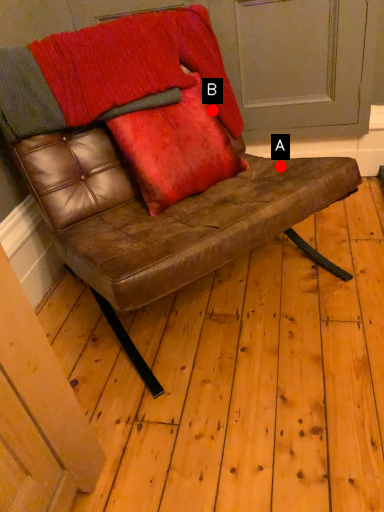
Question: Two points are circled on the image, labeled by A and B beside each circle. Which point appears closest to the camera in this image?

Choices:
 (A) A is closer
 (B) B is closer

Answer: (A)